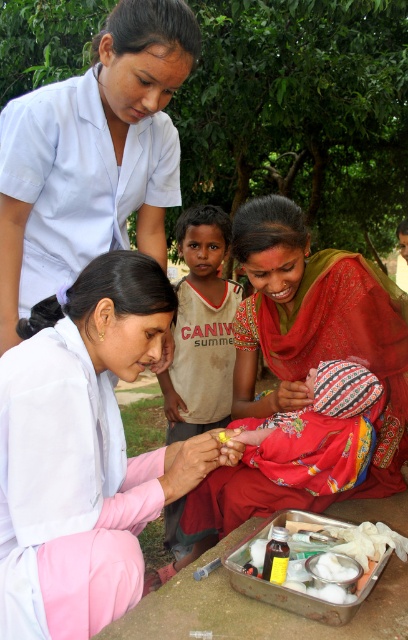
Based on the photo, is white uniform at upper left wider than matte red sari at center?

No, white uniform at upper left is not wider than matte red sari at center.

Describe the element at coordinates (93, 156) in the screenshot. I see `white uniform at upper left` at that location.

Between point (55, 276) and point (294, 212), which one is positioned in front?

Point (55, 276) is in front.

I want to click on white uniform at upper left, so click(x=93, y=156).

Can you confirm if white fabric shirt at center is shorter than white uniform at upper left?

Indeed, white fabric shirt at center has a lesser height compared to white uniform at upper left.

Identify the location of white fabric shirt at center. (82, 452).

What do you see at coordinates (82, 452) in the screenshot? I see `white fabric shirt at center` at bounding box center [82, 452].

Image resolution: width=408 pixels, height=640 pixels. Identify the location of white fabric shirt at center. (82, 452).

Between white fabric shirt at center and matte red sari at center, which one has less height?

Standing shorter between the two is white fabric shirt at center.

Between point (35, 396) and point (266, 256), which one is positioned in front?

Point (35, 396) is in front.

Identify the location of white fabric shirt at center. (82, 452).